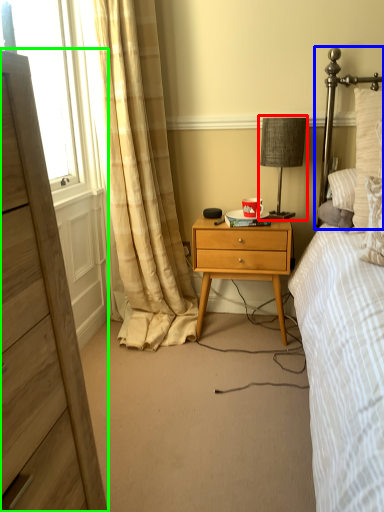
Question: Which object is positioned closest to bedside lamp (highlighted by a red box)? Select from headboard (highlighted by a blue box) and chest of drawers (highlighted by a green box).

Choices:
 (A) headboard
 (B) chest of drawers

Answer: (A)